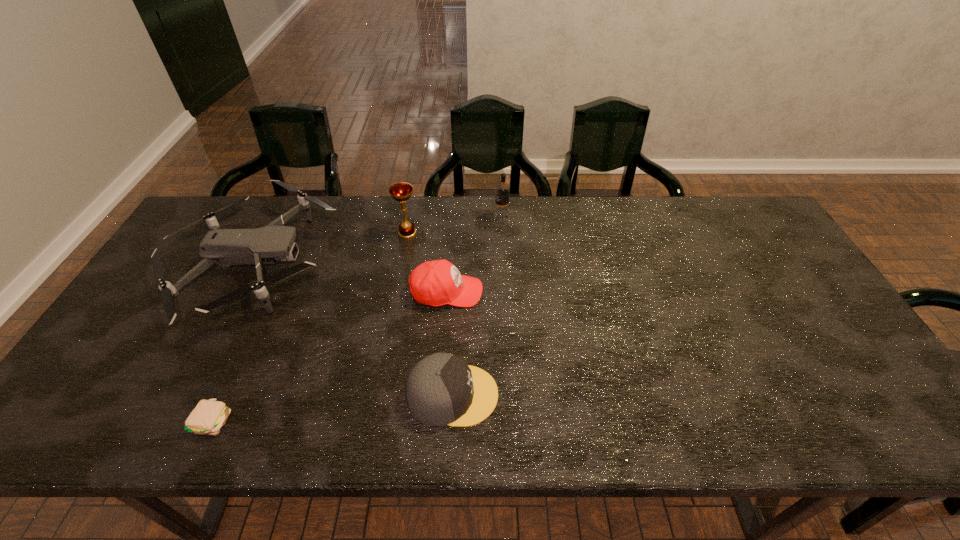
You are a GUI agent. You are given a task and a screenshot of the screen. Output one action in this format:
    pyautogui.click(x=<x>, y=<y>)
    Task: Click on the free space located on the front-facing side of the drone
    
    Given the screenshot: What is the action you would take?
    pyautogui.click(x=420, y=263)

Where is `vacant region located 0.340m on the front panel of the baseball cap`? vacant region located 0.340m on the front panel of the baseball cap is located at coordinates (604, 292).

I want to click on vacant region located on the front-facing side of the cap, so click(x=519, y=395).

Image resolution: width=960 pixels, height=540 pixels. I want to click on vacant area located 0.290m on the left of the shortest object, so click(x=62, y=421).

The height and width of the screenshot is (540, 960). I want to click on vodka that is at the far edge, so click(501, 213).

I want to click on chalice that is positioned at the far edge, so click(x=402, y=191).

Identify the location of drone located at the far edge. (224, 247).

Identify the location of cap that is at the near edge. (442, 389).

Identify the location of patty located at the near edge. The image size is (960, 540). (208, 417).

Image resolution: width=960 pixels, height=540 pixels. Find the location of `object situated at the left edge`. object situated at the left edge is located at coordinates (224, 247).